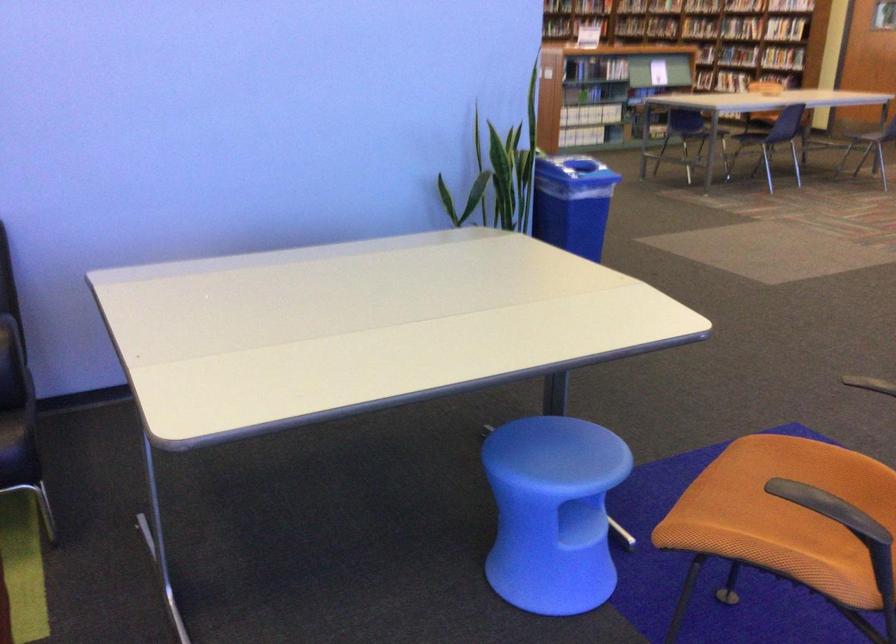
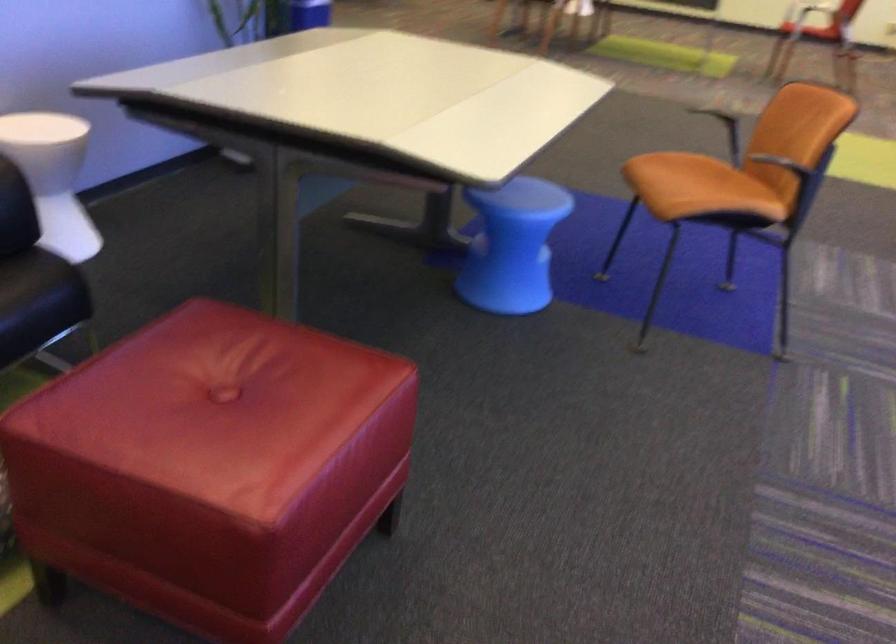
In the second image, find the point that corresponds to point (517, 516) in the first image.

(512, 245)